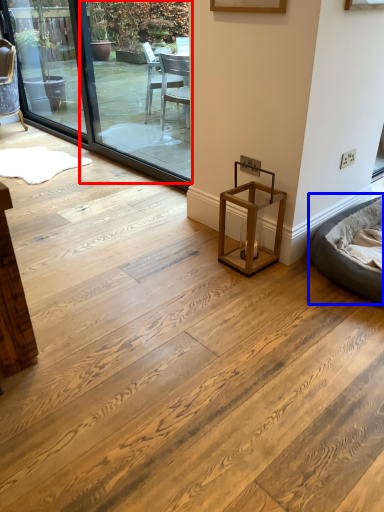
Question: Which point is closer to the camera, window screen (highlighted by a red box) or bean bag chair (highlighted by a blue box)?

Choices:
 (A) window screen
 (B) bean bag chair

Answer: (B)